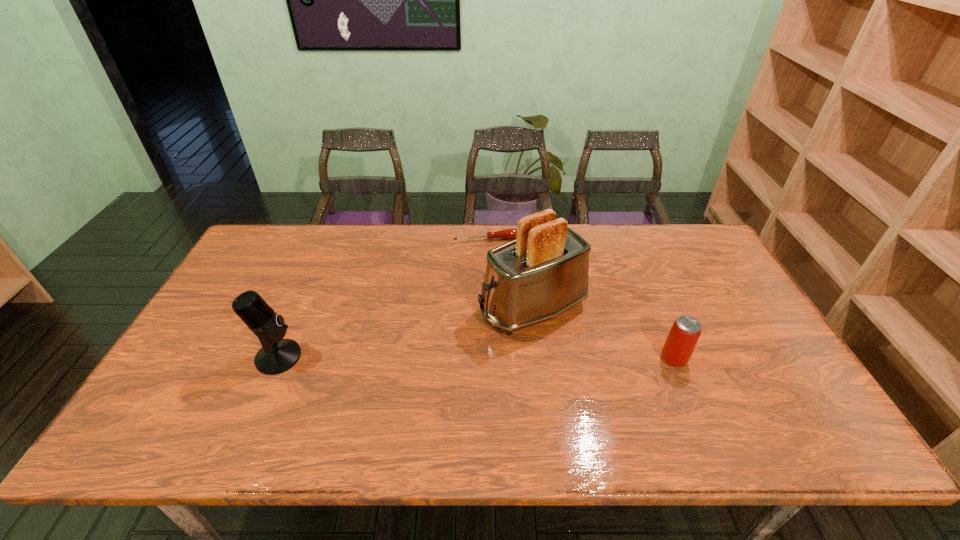
In order to click on vacant space located 0.260m on the side of the toaster with the control lever in this screenshot , I will do `click(398, 362)`.

You are a GUI agent. You are given a task and a screenshot of the screen. Output one action in this format:
    pyautogui.click(x=<x>, y=<y>)
    Task: Click on the free region located 0.230m on the side of the toaster with the control lever
    The height and width of the screenshot is (540, 960).
    Given the screenshot: What is the action you would take?
    pyautogui.click(x=409, y=357)

Find the location of a particular element. The width and height of the screenshot is (960, 540). vacant region located 0.130m at the tip of the farthest object is located at coordinates (500, 267).

The height and width of the screenshot is (540, 960). What are the coordinates of `free spot located at the tip of the farthest object` in the screenshot? It's located at (516, 316).

Where is `vacant space located 0.340m at the tip of the farthest object`? This screenshot has height=540, width=960. vacant space located 0.340m at the tip of the farthest object is located at coordinates (515, 314).

Where is `object that is at the far edge`? Image resolution: width=960 pixels, height=540 pixels. object that is at the far edge is located at coordinates (510, 233).

In the image, there is a desktop. Where is `vacant space at the far edge`? The height and width of the screenshot is (540, 960). vacant space at the far edge is located at coordinates (621, 261).

In the image, there is a desktop. At what (x,y) coordinates should I click in order to perform the action: click on vacant space at the near edge. Please return your answer as a coordinate pair (x, y). Looking at the image, I should click on (270, 409).

Locate an element on the screen. This screenshot has height=540, width=960. free region at the left edge of the desktop is located at coordinates (209, 344).

Locate an element on the screen. The width and height of the screenshot is (960, 540). vacant space at the near left corner of the desktop is located at coordinates (218, 402).